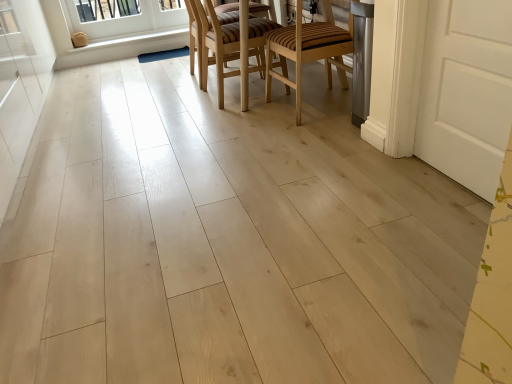
Question: In which direction should I rotate to look at wooden chair at center, which is the 2th chair from right to left?

Choices:
 (A) right
 (B) left

Answer: (B)

Question: Does wooden striped chair at center, which ranks as the 1th chair in right-to-left order, have a greater width compared to white painted wood at upper left?

Choices:
 (A) yes
 (B) no

Answer: (A)

Question: From the image's perspective, is wooden striped chair at center, which is the 2th chair in left-to-right order, below white painted wood at upper left?

Choices:
 (A) no
 (B) yes

Answer: (B)

Question: Is wooden striped chair at center, which is the 2th chair in left-to-right order, turned away from white painted wood at upper left?

Choices:
 (A) no
 (B) yes

Answer: (A)

Question: Is wooden striped chair at center, which ranks as the 1th chair in right-to-left order, not inside white painted wood at upper left?

Choices:
 (A) yes
 (B) no

Answer: (A)

Question: From a real-world perspective, is wooden striped chair at center, which is the 2th chair in left-to-right order, on white painted wood at upper left?

Choices:
 (A) yes
 (B) no

Answer: (A)

Question: Would you consider wooden striped chair at center, which ranks as the 1th chair in right-to-left order, to be distant from white painted wood at upper left?

Choices:
 (A) no
 (B) yes

Answer: (B)

Question: Is white wood screen door at left positioned before white painted wood at upper left?

Choices:
 (A) no
 (B) yes

Answer: (B)

Question: Is white wood screen door at left not within white painted wood at upper left?

Choices:
 (A) no
 (B) yes

Answer: (B)

Question: Could you tell me if white wood screen door at left is turned towards white painted wood at upper left?

Choices:
 (A) yes
 (B) no

Answer: (A)

Question: Does white wood screen door at left appear on the left side of white painted wood at upper left?

Choices:
 (A) no
 (B) yes

Answer: (B)

Question: Is white wood screen door at left in contact with white painted wood at upper left?

Choices:
 (A) no
 (B) yes

Answer: (A)

Question: Can you confirm if white wood screen door at left is wider than white painted wood at upper left?

Choices:
 (A) no
 (B) yes

Answer: (B)

Question: From a real-world perspective, is white wood window at upper left beneath white painted wood at upper left?

Choices:
 (A) yes
 (B) no

Answer: (B)